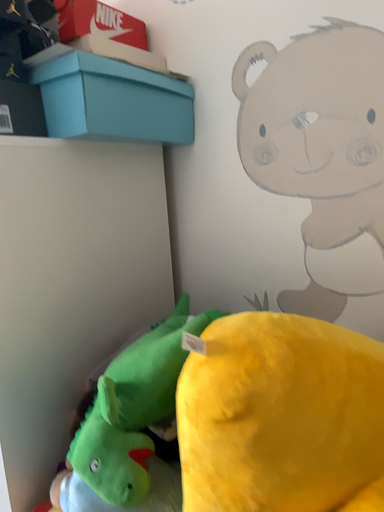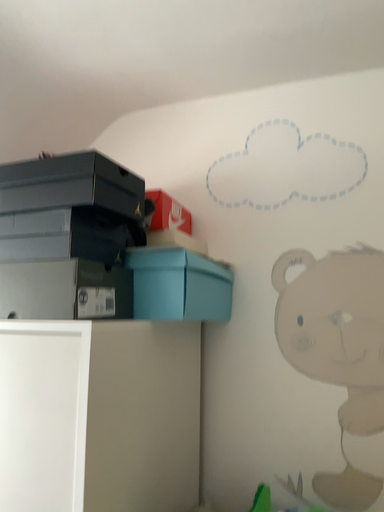
Question: Which way did the camera rotate in the video?

Choices:
 (A) rotated upward
 (B) rotated downward

Answer: (A)